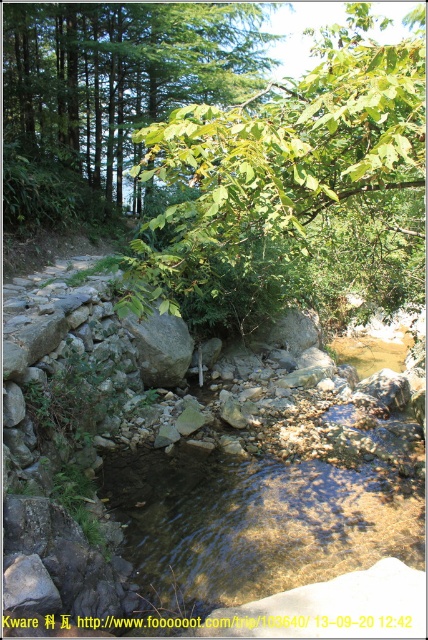
Which is above, green leafy tree at center or green leafy tree at upper center?

green leafy tree at upper center

Does point (350, 221) come closer to viewer compared to point (264, 13)?

Yes, point (350, 221) is closer to viewer.

Is point (422, 20) positioned behind point (152, 61)?

No, it is in front of (152, 61).

In order to click on green leafy tree at center in this screenshot , I will do `click(275, 172)`.

Describe the element at coordinates (255, 522) in the screenshot. I see `clear water at center` at that location.

How much distance is there between clear water at center and green leafy tree at upper center?

clear water at center is 11.26 meters from green leafy tree at upper center.

Is point (294, 464) positioned behind point (33, 205)?

No, (294, 464) is closer to viewer.

At what (x,y) coordinates should I click in order to perform the action: click on clear water at center. Please return your answer as a coordinate pair (x, y). Looking at the image, I should click on (255, 522).

Can you confirm if green leafy tree at center is positioned to the left of clear water at center?

In fact, green leafy tree at center is to the right of clear water at center.

Does green leafy tree at center appear under clear water at center?

No.

Does point (350, 113) come closer to viewer compared to point (269, 493)?

Yes, point (350, 113) is in front of point (269, 493).

Find the location of `green leafy tree at center`. green leafy tree at center is located at coordinates (275, 172).